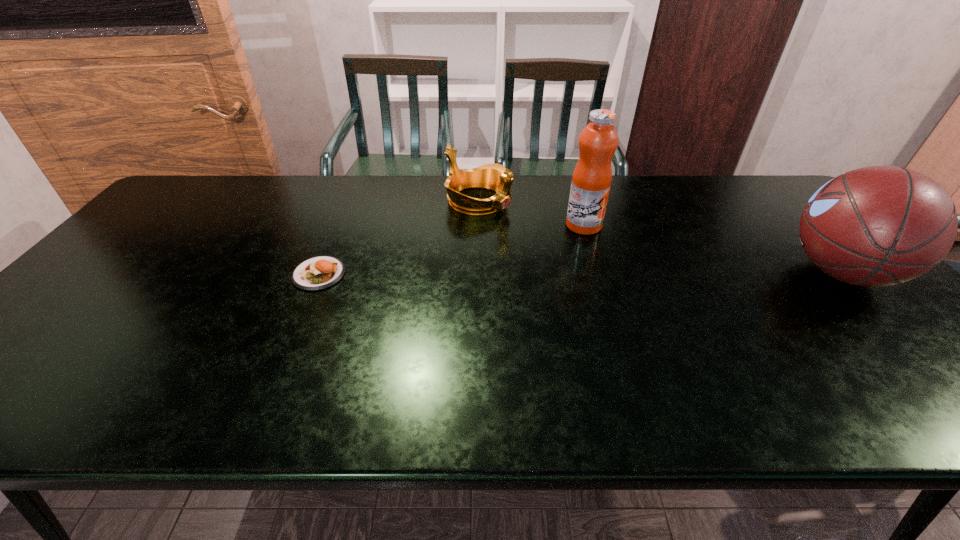
The width and height of the screenshot is (960, 540). Identify the location of free space on the desktop that is between the patty (food) and the basketball and is positioned on the front label of the second object from right to left. (626, 273).

You are a GUI agent. You are given a task and a screenshot of the screen. Output one action in this format:
    pyautogui.click(x=<x>, y=<y>)
    Task: Click on the free space on the desktop that is between the leftmost object and the basketball and is positioned at the front emblem of the tiara
    Image resolution: width=960 pixels, height=540 pixels.
    Given the screenshot: What is the action you would take?
    pyautogui.click(x=631, y=273)